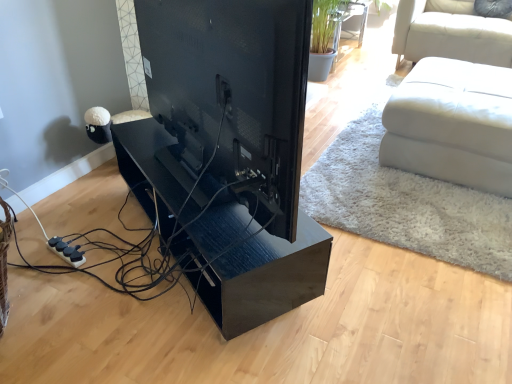
Describe the element at coordinates (233, 92) in the screenshot. The image size is (512, 384). I see `black glossy tv at center` at that location.

The image size is (512, 384). Describe the element at coordinates (452, 124) in the screenshot. I see `white leather ottoman at right` at that location.

Locate an element on the screen. This screenshot has width=512, height=384. black glossy tv at center is located at coordinates (233, 92).

Which object is further away from the camera taking this photo, glossy wood table at center or black glossy tv at center?

glossy wood table at center is further away from the camera.

Would you say glossy wood table at center is to the left or to the right of black glossy tv at center in the picture?

From the image, it's evident that glossy wood table at center is to the right of black glossy tv at center.

Can we say glossy wood table at center lies outside black glossy tv at center?

glossy wood table at center lies outside black glossy tv at center's area.

Which of these two, glossy wood table at center or black glossy tv at center, is wider?

With larger width is glossy wood table at center.

Is white leather ottoman at right oriented towards black glossy tv at center?

No.

Is white leather ottoman at right positioned far away from black glossy tv at center?

Yes.

Does white leather ottoman at right have a smaller size compared to black glossy tv at center?

Actually, white leather ottoman at right might be larger than black glossy tv at center.

Does white leather ottoman at right lie in front of black glossy tv at center?

No, white leather ottoman at right is further to the viewer.

From the image's perspective, does glossy wood table at center appear higher than white leather ottoman at right?

No.

Considering the positions of point (129, 157) and point (447, 170), is point (129, 157) closer or farther from the camera than point (447, 170)?

Point (129, 157) is positioned closer to the camera compared to point (447, 170).

From a real-world perspective, who is located higher, glossy wood table at center or white leather ottoman at right?

In real-world perspective, white leather ottoman at right is above.

Which of these two, glossy wood table at center or white leather ottoman at right, is bigger?

white leather ottoman at right.

Considering the sizes of black glossy tv at center and white leather ottoman at right in the image, is black glossy tv at center bigger or smaller than white leather ottoman at right?

In the image, black glossy tv at center appears to be smaller than white leather ottoman at right.

How much distance is there between black glossy tv at center and white leather ottoman at right?

The distance of black glossy tv at center from white leather ottoman at right is 1.28 meters.

Does black glossy tv at center have a greater width compared to white leather ottoman at right?

Incorrect, the width of black glossy tv at center does not surpass that of white leather ottoman at right.

From the image's perspective, relative to white leather ottoman at right, is black glossy tv at center above or below?

Clearly, from the image's perspective, black glossy tv at center is below white leather ottoman at right.

Considering the relative sizes of black glossy tv at center and glossy wood table at center in the image provided, is black glossy tv at center smaller than glossy wood table at center?

Yes.

From the image's perspective, which is below, black glossy tv at center or glossy wood table at center?

From the image's view, glossy wood table at center is below.

Image resolution: width=512 pixels, height=384 pixels. Identify the location of desktop computer to the left of glossy wood table at center. (233, 92).

Is white leather ottoman at right positioned with its back to glossy wood table at center?

No.

In the scene shown: Measure the distance between white leather ottoman at right and glossy wood table at center.

They are 3.48 feet apart.

Is white leather ottoman at right with glossy wood table at center?

No, white leather ottoman at right is not next to glossy wood table at center.

At what (x,y) coordinates should I click in order to perform the action: click on table on the left of white leather ottoman at right. Please return your answer as a coordinate pair (x, y). Looking at the image, I should click on (265, 277).

At what (x,y) coordinates should I click in order to perform the action: click on desktop computer that appears in front of the glossy wood table at center. Please return your answer as a coordinate pair (x, y). Looking at the image, I should click on (233, 92).

Where is `desktop computer that is on the left side of white leather ottoman at right`? Image resolution: width=512 pixels, height=384 pixels. desktop computer that is on the left side of white leather ottoman at right is located at coordinates (233, 92).

Considering their positions, is white leather ottoman at right positioned closer to glossy wood table at center than black glossy tv at center?

black glossy tv at center is positioned closer to the anchor glossy wood table at center.

Based on their spatial positions, is white leather ottoman at right or glossy wood table at center closer to black glossy tv at center?

Among the two, glossy wood table at center is located nearer to black glossy tv at center.

Which object lies nearer to the anchor point glossy wood table at center, black glossy tv at center or white leather ottoman at right?

black glossy tv at center.

From the image, which object appears to be nearer to black glossy tv at center, glossy wood table at center or white leather ottoman at right?

glossy wood table at center is closer to black glossy tv at center.

From the picture: Which object lies nearer to the anchor point white leather ottoman at right, glossy wood table at center or black glossy tv at center?

Among the two, glossy wood table at center is located nearer to white leather ottoman at right.

From the image, which object appears to be farther from white leather ottoman at right, black glossy tv at center or glossy wood table at center?

The object further to white leather ottoman at right is black glossy tv at center.

This screenshot has height=384, width=512. I want to click on table between black glossy tv at center and white leather ottoman at right, so click(x=265, y=277).